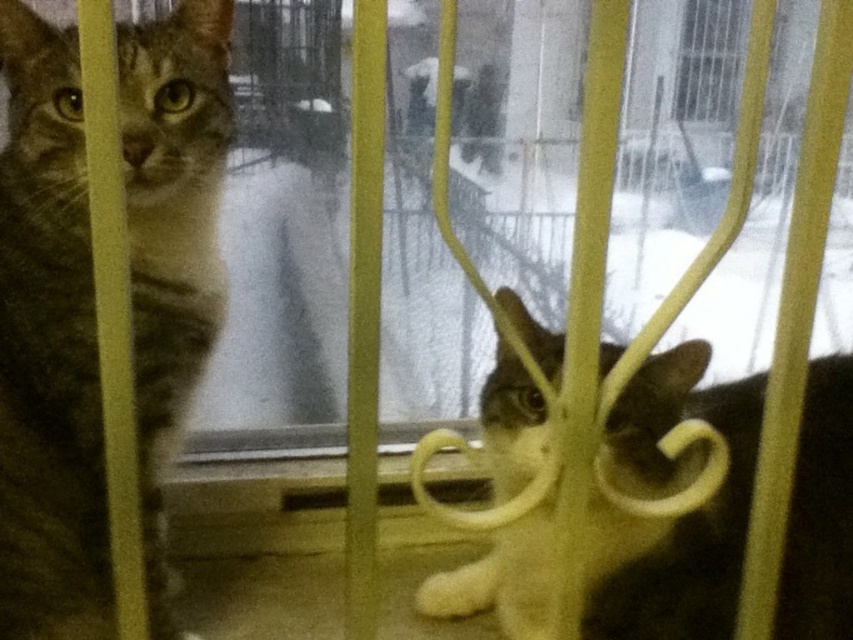
Question: Where is tabby fur cat at left located in relation to dark brown fur cat at center in the image?

Choices:
 (A) right
 (B) left

Answer: (B)

Question: Which object appears farthest from the camera in this image?

Choices:
 (A) tabby fur cat at left
 (B) dark brown fur cat at center

Answer: (A)

Question: Which point is farther to the camera?

Choices:
 (A) dark brown fur cat at center
 (B) tabby fur cat at left

Answer: (B)

Question: Can you confirm if tabby fur cat at left is bigger than dark brown fur cat at center?

Choices:
 (A) yes
 (B) no

Answer: (B)

Question: Is tabby fur cat at left to the right of dark brown fur cat at center from the viewer's perspective?

Choices:
 (A) no
 (B) yes

Answer: (A)

Question: Which point appears closest to the camera in this image?

Choices:
 (A) [x=822, y=604]
 (B) [x=73, y=604]

Answer: (B)